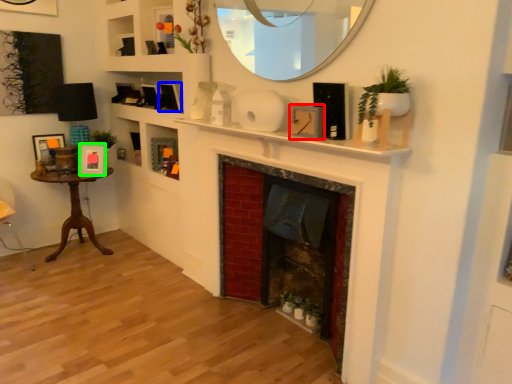
Question: Estimate the real-world distances between objects in this image. Which object is farther from picture frame (highlighted by a red box), picture frame (highlighted by a blue box) or picture frame (highlighted by a green box)?

Choices:
 (A) picture frame
 (B) picture frame

Answer: (B)